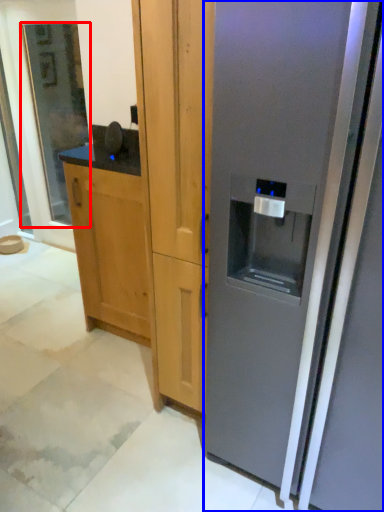
Question: Which point is closer to the camera, glass door (highlighted by a red box) or refrigerator (highlighted by a blue box)?

Choices:
 (A) glass door
 (B) refrigerator

Answer: (B)